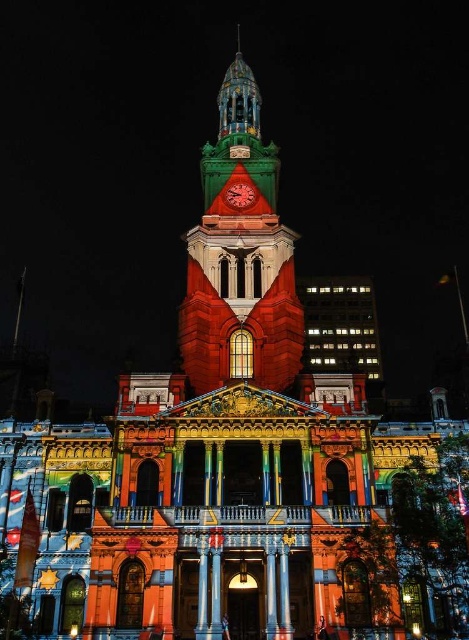
Does point (240, 113) lie in front of point (233, 202)?

No, (240, 113) is behind (233, 202).

Is green stone clock tower at center shorter than metallic clock at center?

Incorrect, green stone clock tower at center's height does not fall short of metallic clock at center's.

Who is more distant from viewer, (x=242, y=211) or (x=234, y=193)?

The point (x=234, y=193) is more distant.

What are the coordinates of `green stone clock tower at center` in the screenshot? It's located at (240, 253).